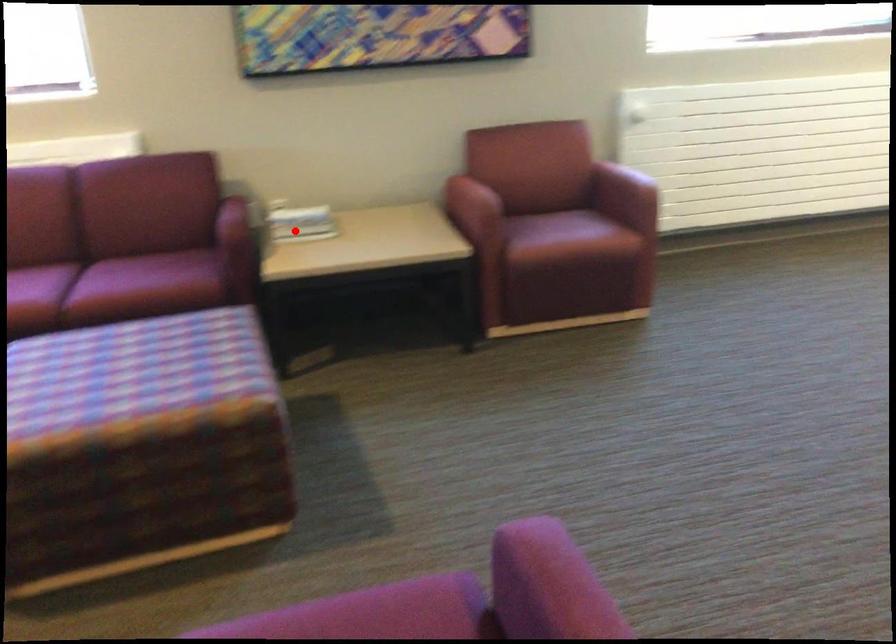
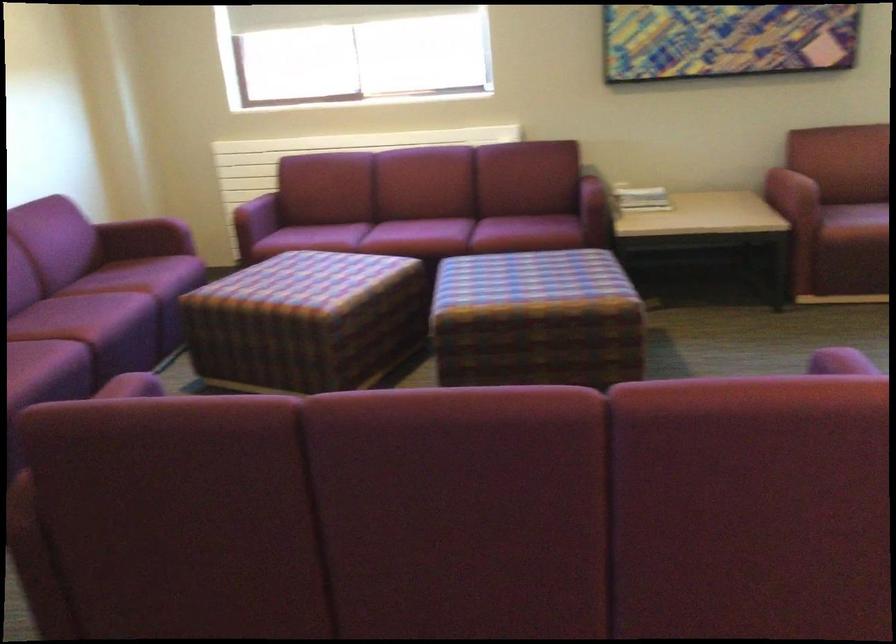
Question: I am providing you with two images of the same scene from different viewpoints. Given a red point in image1, look at the same physical point in image2. Is it:

Choices:
 (A) Closer to the viewpoint
 (B) Farther from the viewpoint

Answer: (B)